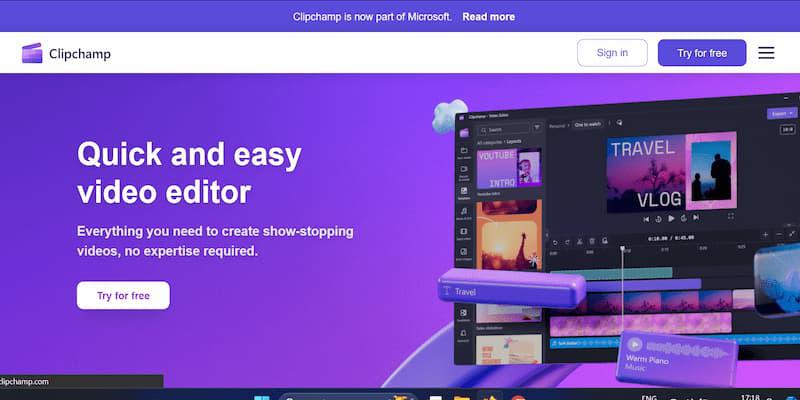
Where is `image of desktop`? This screenshot has height=400, width=800. image of desktop is located at coordinates (529, 167), (570, 317), (742, 187).